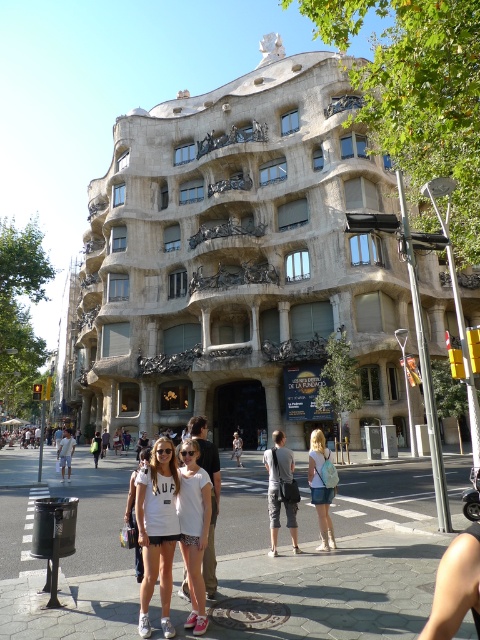
Question: Is matte white t-shirt at center closer to the viewer compared to denim skirt at center?

Choices:
 (A) yes
 (B) no

Answer: (A)

Question: Can you confirm if paved stone sidewalk at lower center is positioned to the right of gray cotton shorts at center?

Choices:
 (A) yes
 (B) no

Answer: (B)

Question: Which point is farther to the camera?

Choices:
 (A) white cotton t-shirt at center
 (B) matte white t-shirt at center
 (C) paved stone sidewalk at center
 (D) denim skirt at center

Answer: (D)

Question: Is stone textured building at center in front of paved stone sidewalk at lower center?

Choices:
 (A) yes
 (B) no

Answer: (B)

Question: Among these points, which one is farthest from the camera?

Choices:
 (A) (288, 536)
 (B) (387, 250)

Answer: (B)

Question: Which object appears farthest from the camera in this image?

Choices:
 (A) white cotton t-shirt at center
 (B) paved stone sidewalk at lower center

Answer: (A)